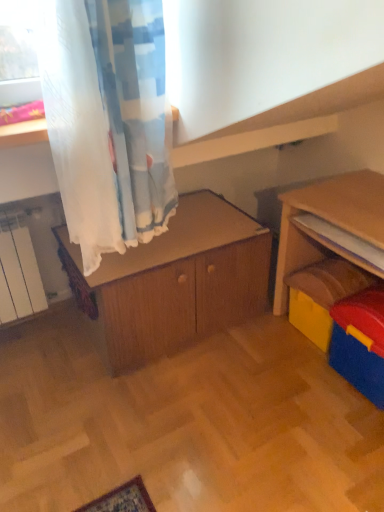
This screenshot has height=512, width=384. In order to click on empty space that is ontop of wooden cabinet at center (from a real-world perspective) in this screenshot , I will do `click(192, 223)`.